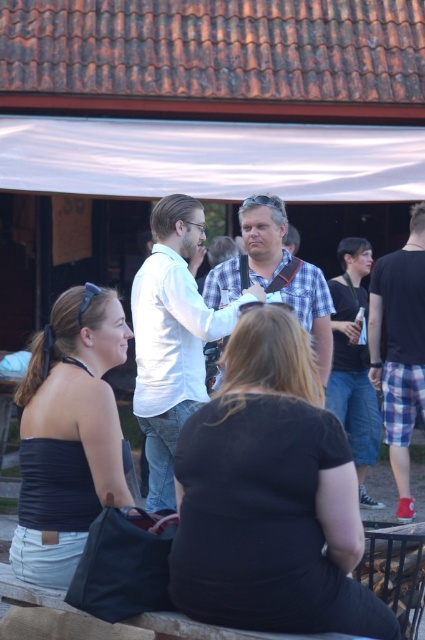
You are a photographer trying to capture a candid shot of both the matte black tank top at lower left and the white cotton shirt at center. Since you want to ensure both subjects are in focus, which one should you focus on first to get the best depth of field?

The matte black tank top at lower left is in front of the white cotton shirt at center, so focusing on the matte black tank top at lower left first would ensure both are in focus due to its closer position.

You are organizing a clothing display and need to arrange two shirts from the image. The white cotton shirt at center and the checkered fabric shirt at center must be placed on a vertical rack. Which shirt should you place higher up to ensure both are fully visible?

The white cotton shirt at center should be placed higher up on the rack since it has a greater height compared to the checkered fabric shirt at center, allowing both to be fully visible without overlapping.

You are organizing a charity event and need to decide which clothing item to use as a backdrop. The backdrop requires a fabric that is not too thick to avoid blocking the view. Based on the image, which item between the matte black tank top at lower left and the white cotton shirt at center would be more suitable for the backdrop?

The matte black tank top at lower left is thinner than the white cotton shirt at center, so it would be more suitable for the backdrop as it is less likely to block the view.